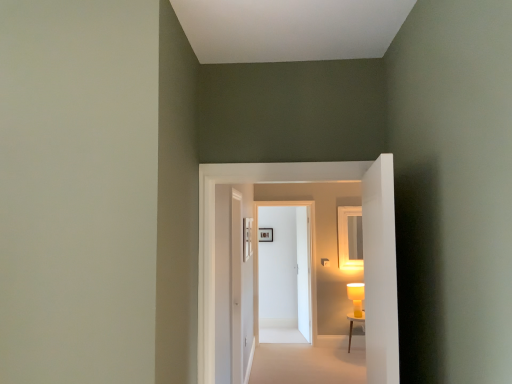
This screenshot has width=512, height=384. What do you see at coordinates (303, 271) in the screenshot?
I see `white glossy door at center, marked as the third door in a front-to-back arrangement` at bounding box center [303, 271].

Identify the location of beige carpet at center. The image size is (512, 384). point(310,362).

Where is `matte black picture frame at center`? matte black picture frame at center is located at coordinates (265, 234).

Image resolution: width=512 pixels, height=384 pixels. Identify the location of white glossy door at center, the 1th door from the front. (361, 265).

Describe the element at coordinates (352, 325) in the screenshot. This screenshot has width=512, height=384. I see `white wooden table at lower right` at that location.

At what (x,y) coordinates should I click in order to perform the action: click on white glossy door at center, positioned as the first door in back-to-front order. Please return your answer as a coordinate pair (x, y). The width and height of the screenshot is (512, 384). Looking at the image, I should click on (303, 271).

In the scene shown: Can you confirm if beige carpet at center is taller than matte yellow table lamp at right?

In fact, beige carpet at center may be shorter than matte yellow table lamp at right.

From the image's perspective, is beige carpet at center above or below matte yellow table lamp at right?

Based on their image positions, beige carpet at center is located beneath matte yellow table lamp at right.

Is beige carpet at center to the left or to the right of matte yellow table lamp at right in the image?

From the image, it's evident that beige carpet at center is to the left of matte yellow table lamp at right.

Based on the photo, is matte yellow table lamp at right at the back of beige carpet at center?

No, beige carpet at center is not facing the opposite direction of matte yellow table lamp at right.

Considering the sizes of matte yellow table lamp at right and white wooden table at lower right in the image, is matte yellow table lamp at right taller or shorter than white wooden table at lower right?

Clearly, matte yellow table lamp at right is shorter compared to white wooden table at lower right.

Is matte yellow table lamp at right turned away from white wooden table at lower right?

matte yellow table lamp at right does not have its back to white wooden table at lower right.

Is matte yellow table lamp at right spatially inside white wooden table at lower right, or outside of it?

matte yellow table lamp at right is not enclosed by white wooden table at lower right.

Which object is positioned more to the left, matte yellow table lamp at right or white wooden table at lower right?

white wooden table at lower right is more to the left.

From a real-world perspective, which object rests below the other?

matte yellow table lamp at right is physically lower.

Is white glossy door at center, positioned as the first door in back-to-front order, not close to matte yellow table lamp at right?

No, white glossy door at center, positioned as the first door in back-to-front order, is in close proximity to matte yellow table lamp at right.

Which object is further away from the camera taking this photo, white glossy door at center, positioned as the first door in back-to-front order, or matte yellow table lamp at right?

white glossy door at center, positioned as the first door in back-to-front order, is more distant.

From the image's perspective, who appears lower, white glossy door at center, positioned as the first door in back-to-front order, or matte yellow table lamp at right?

matte yellow table lamp at right appears lower in the image.

Does white glossy door at center, positioned as the first door in back-to-front order, have a smaller size compared to white wooden table at lower right?

No, white glossy door at center, positioned as the first door in back-to-front order, is not smaller than white wooden table at lower right.

Can you confirm if white glossy door at center, marked as the third door in a front-to-back arrangement, is positioned to the right of white wooden table at lower right?

No, white glossy door at center, marked as the third door in a front-to-back arrangement, is not to the right of white wooden table at lower right.

Considering the sizes of objects white glossy door at center, marked as the third door in a front-to-back arrangement, and white wooden table at lower right in the image provided, who is shorter, white glossy door at center, marked as the third door in a front-to-back arrangement, or white wooden table at lower right?

white wooden table at lower right is shorter.

Find the location of a particular element. table that is below the white glossy door at center, positioned as the first door in back-to-front order (from the image's perspective) is located at coordinates (352, 325).

From a real-world perspective, which is physically above, white wooden table at lower right or beige carpet at center?

From a 3D spatial view, white wooden table at lower right is above.

Is white wooden table at lower right outside of beige carpet at center?

Yes, white wooden table at lower right is not within beige carpet at center.

Does white wooden table at lower right have a lesser height compared to beige carpet at center?

No.

Considering the positions of point (349, 335) and point (290, 360), is point (349, 335) closer or farther from the camera than point (290, 360)?

Point (349, 335) is positioned farther from the camera compared to point (290, 360).

Which is less distant, (349,346) or (263,233)?

Point (349,346) is positioned closer to the camera compared to point (263,233).

From the image's perspective, does white wooden table at lower right appear lower than matte black picture frame at center?

Yes.

Does white wooden table at lower right appear on the left side of matte black picture frame at center?

In fact, white wooden table at lower right is to the right of matte black picture frame at center.

Is there a large distance between white wooden table at lower right and matte black picture frame at center?

Yes.

Is matte black picture frame at center bigger than white glossy door at center, marked as the third door in a front-to-back arrangement?

Actually, matte black picture frame at center might be smaller than white glossy door at center, marked as the third door in a front-to-back arrangement.

Considering the sizes of matte black picture frame at center and white glossy door at center, marked as the third door in a front-to-back arrangement, in the image, is matte black picture frame at center taller or shorter than white glossy door at center, marked as the third door in a front-to-back arrangement,?

matte black picture frame at center is shorter than white glossy door at center, marked as the third door in a front-to-back arrangement.

Is matte black picture frame at center beside white glossy door at center, marked as the third door in a front-to-back arrangement?

matte black picture frame at center and white glossy door at center, marked as the third door in a front-to-back arrangement, are not in contact.

Which object is further away from the camera, matte black picture frame at center or white glossy door at center, positioned as the first door in back-to-front order?

matte black picture frame at center is more distant.

Identify the location of path beneath the matte yellow table lamp at right (from a real-world perspective). The height and width of the screenshot is (384, 512). (310, 362).

I want to click on table lamp above the white wooden table at lower right (from the image's perspective), so coord(356,297).

Which object lies further to the anchor point white wooden table at lower right, matte black picture frame at center or white glossy door at center, the 1th door from the front?

Based on the image, white glossy door at center, the 1th door from the front, appears to be further to white wooden table at lower right.

Looking at the image, which one is located closer to white glossy door at center, acting as the second door starting from the back, white wooden table at lower right or matte black picture frame at center?

Among the two, matte black picture frame at center is located nearer to white glossy door at center, acting as the second door starting from the back.

Estimate the real-world distances between objects in this image. Which object is further from white glossy door at center, the 1th door from the front, beige carpet at center or matte black picture frame at center?

matte black picture frame at center lies further to white glossy door at center, the 1th door from the front, than the other object.

From the image, which object appears to be nearer to white glossy door at center, marked as the third door in a front-to-back arrangement, white wooden table at lower right or matte yellow table lamp at right?

Based on the image, matte yellow table lamp at right appears to be nearer to white glossy door at center, marked as the third door in a front-to-back arrangement.

When comparing their distances from white wooden table at lower right, does matte black picture frame at center or beige carpet at center seem closer?

Among the two, beige carpet at center is located nearer to white wooden table at lower right.

Estimate the real-world distances between objects in this image. Which object is further from beige carpet at center, matte yellow table lamp at right or white glossy door at center, the 2th door from the front?

white glossy door at center, the 2th door from the front, is positioned further to the anchor beige carpet at center.

Considering their positions, is matte black picture frame at center positioned closer to white wooden table at lower right than white glossy door at center, the 2th door from the front?

Among the two, white glossy door at center, the 2th door from the front, is located nearer to white wooden table at lower right.

When comparing their distances from white wooden table at lower right, does white glossy door at center, the third door when ordered from back to front, or matte yellow table lamp at right seem closer?

matte yellow table lamp at right lies closer to white wooden table at lower right than the other object.

Where is `door between white glossy door at center, the 2th door from the front, and matte black picture frame at center, along the z-axis`? The height and width of the screenshot is (384, 512). door between white glossy door at center, the 2th door from the front, and matte black picture frame at center, along the z-axis is located at coordinates (303, 271).

What are the coordinates of `table lamp between beige carpet at center and white glossy door at center, the 2th door from the front, from front to back` in the screenshot? It's located at (356, 297).

Find the location of `table lamp between white wooden table at lower right and white glossy door at center, marked as the third door in a front-to-back arrangement, along the z-axis`. table lamp between white wooden table at lower right and white glossy door at center, marked as the third door in a front-to-back arrangement, along the z-axis is located at coordinates (356, 297).

Where is `path between white glossy door at center, the third door when ordered from back to front, and matte black picture frame at center from front to back`? The width and height of the screenshot is (512, 384). path between white glossy door at center, the third door when ordered from back to front, and matte black picture frame at center from front to back is located at coordinates (310, 362).